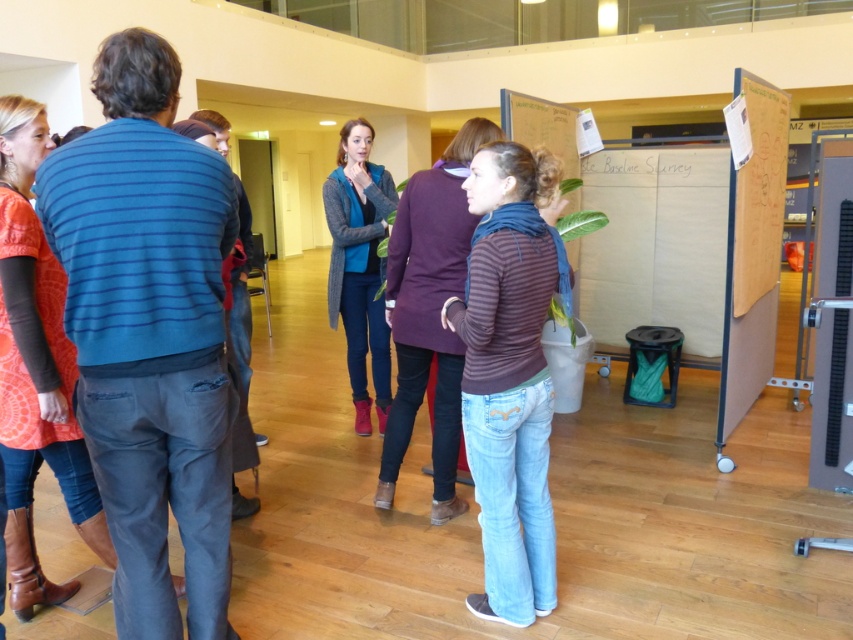
You are standing in the conference room and want to hand out a document to everyone. The knitted sweater at center and the white cardboard bulletin board at center are in your way. Which one should you move first to clear the path?

The knitted sweater at center is behind the white cardboard bulletin board at center, so you should move the white cardboard bulletin board at center first to clear the path.

You are standing in the conference room and notice two points marked on the floor. The first is at coordinates point [54,172] and the second at point [364,161]. Which point is nearer to you?

Point [54,172] is closer to the viewer than point [364,161].

You are standing in the conference room and want to move from the point at coordinates (579, 266) to the point at coordinates (376, 301). Can you walk directly between these two points without needing to go around any obstacles?

Point (579, 266) is behind point (376, 301), so you cannot walk directly between them without moving around the obstacle in front of point (579, 266).